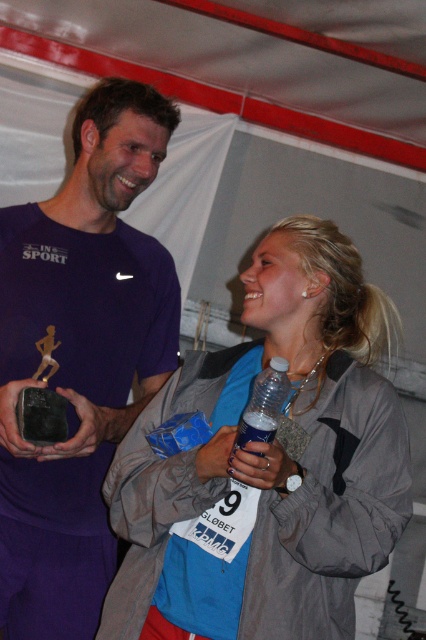
You are a photographer at the event and need to capture a closeup of both the clear plastic bottle at center and the matte plastic water bottle at lower center. What is the minimum distance you need to adjust your camera to focus on both objects?

The clear plastic bottle at center and the matte plastic water bottle at lower center are 2.31 inches apart, so the minimum distance adjustment needed is 2.31 inches to ensure both are in focus.